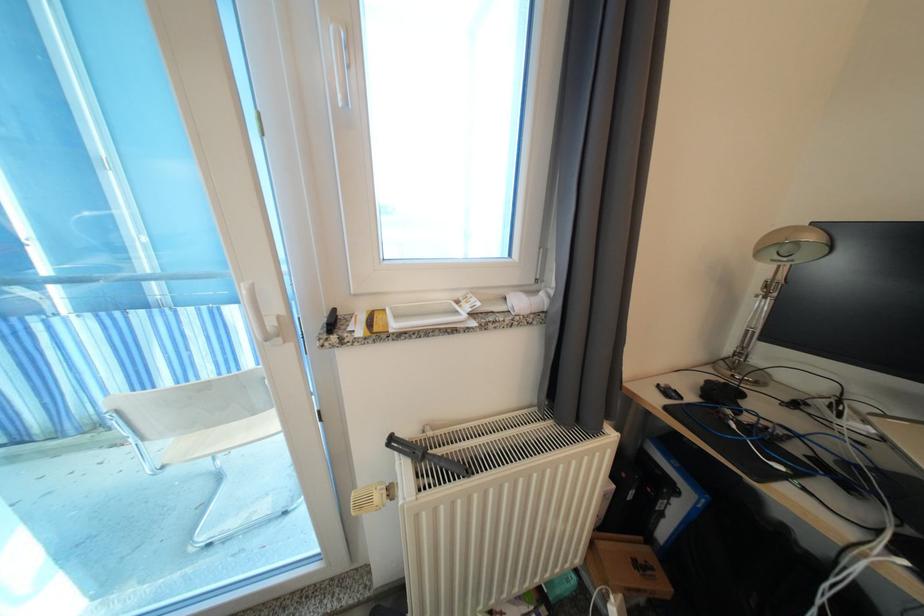
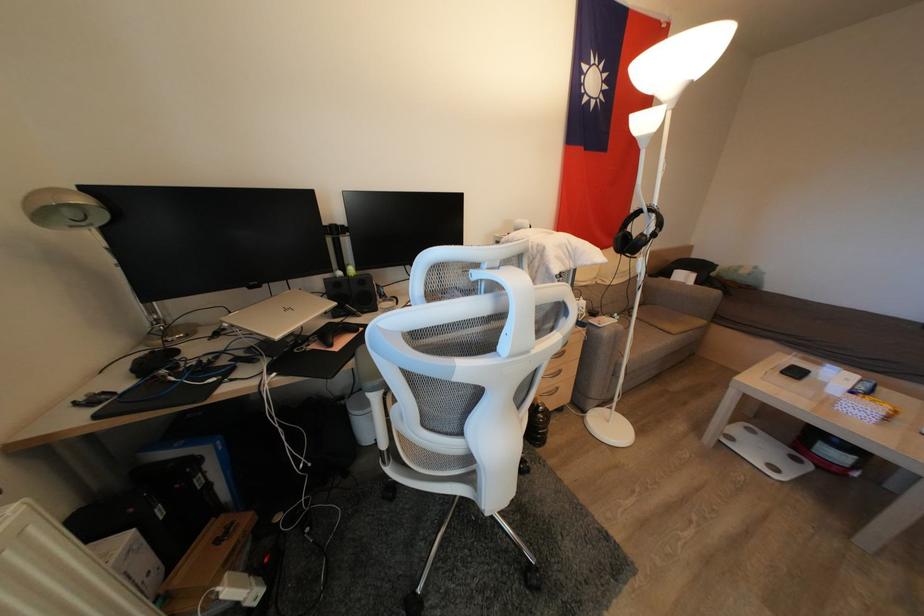
First-person continuous shooting, in which direction is the camera rotating?

The camera rotated toward right-down.